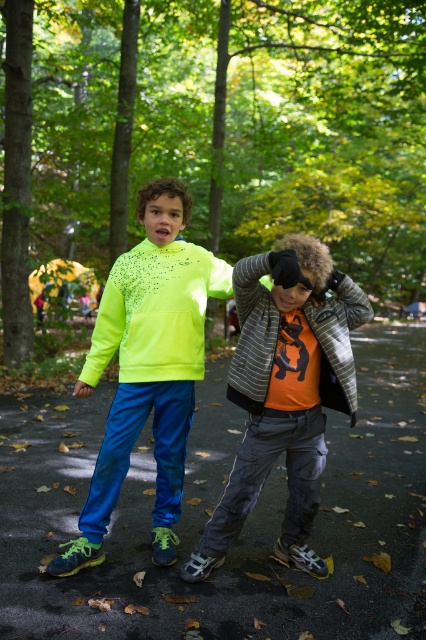
You are a photographer trying to capture both the neon yellow hoodie at center and the neon matte sweatshirt at left in a single frame. Given their widths, which one might require you to adjust your camera angle to ensure it fits entirely within the photo?

The neon yellow hoodie at center has a greater width than the neon matte sweatshirt at left, so you would need to adjust your camera angle to accommodate its wider size to ensure it fits entirely within the photo.

You are a photographer trying to capture both the orange matte shirt at center and the neon yellow hoodie at center in a single frame. Based on their heights, which clothing item will appear larger in the photo?

The neon yellow hoodie at center appears taller than the orange matte shirt at center, so it will look larger in the photo.